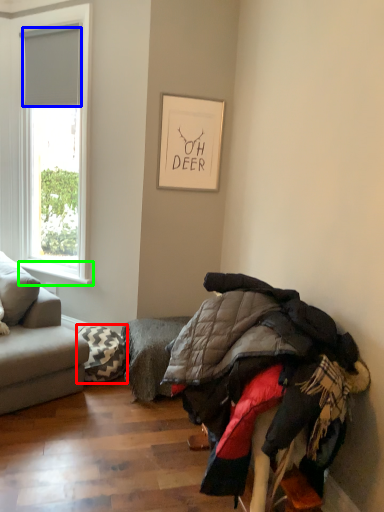
Question: Which object is the farthest from pillow (highlighted by a red box)? Choose among these: blind (highlighted by a blue box) or window sill (highlighted by a green box).

Choices:
 (A) blind
 (B) window sill

Answer: (A)